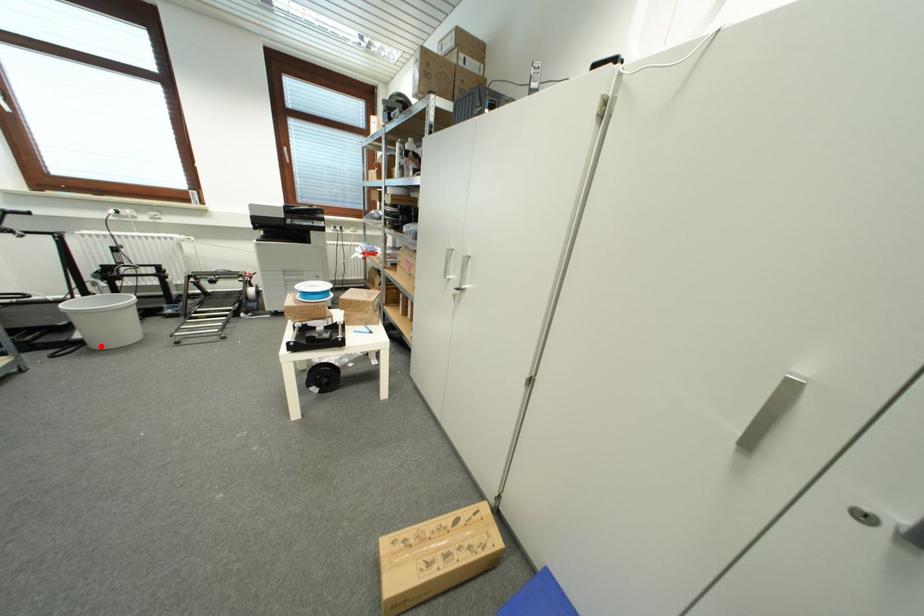
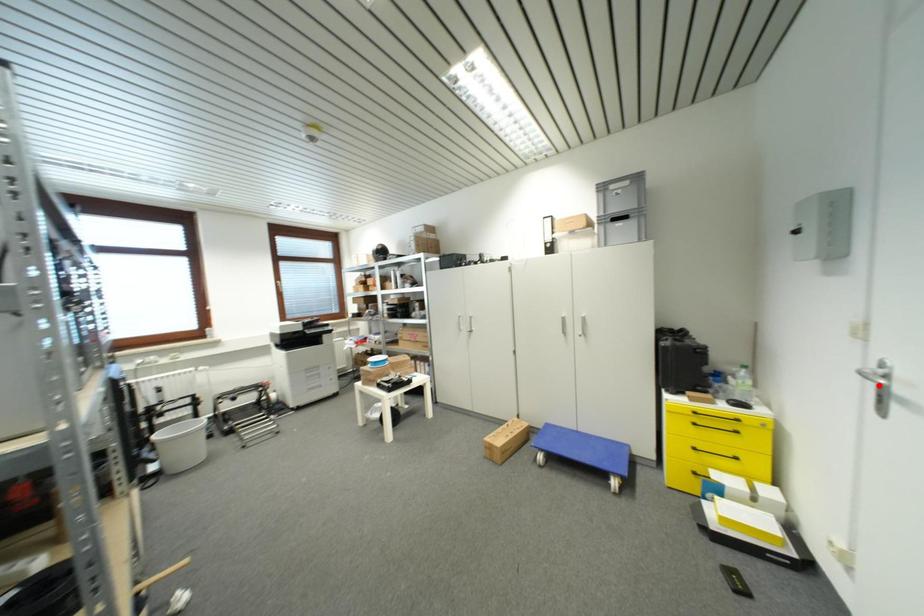
I am providing you with two images of the same scene from different viewpoints. A red point is marked on the first image and another point is marked on the second image. Is the marked point in image1 the same physical position as the marked point in image2?

No